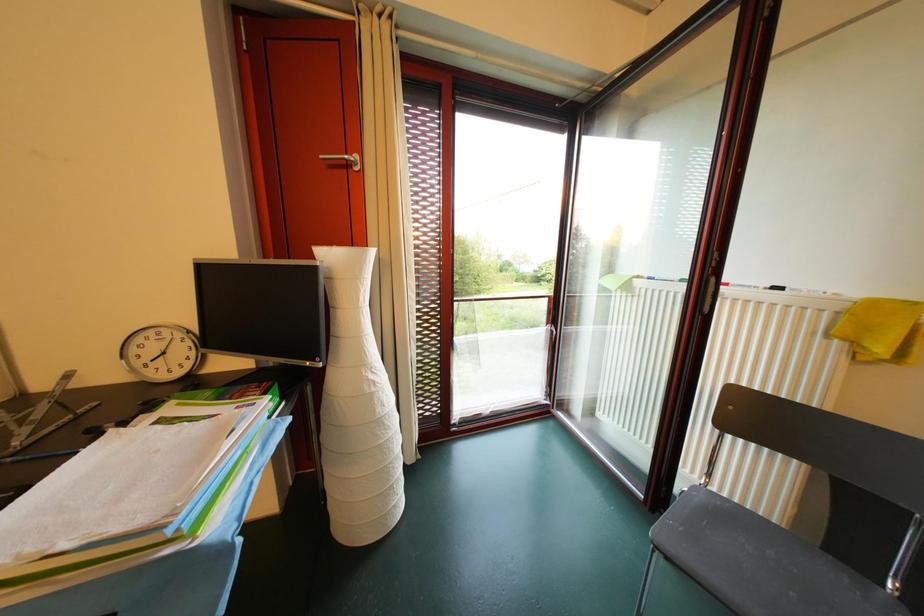
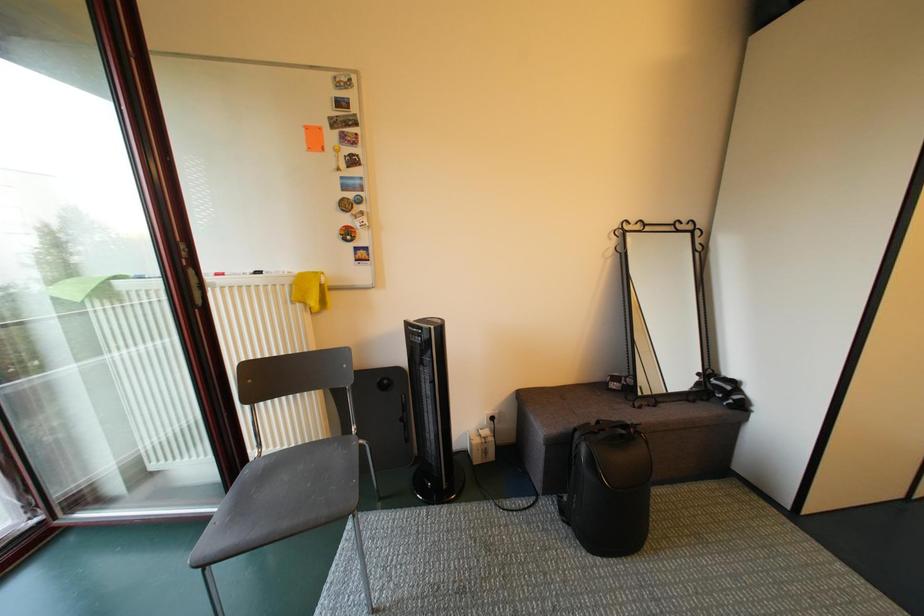
Question: Based on the continuous images, in which direction is the camera rotating? Reply with the corresponding letter.

Choices:
 (A) Left
 (B) Right
 (C) Up
 (D) Down

Answer: (B)